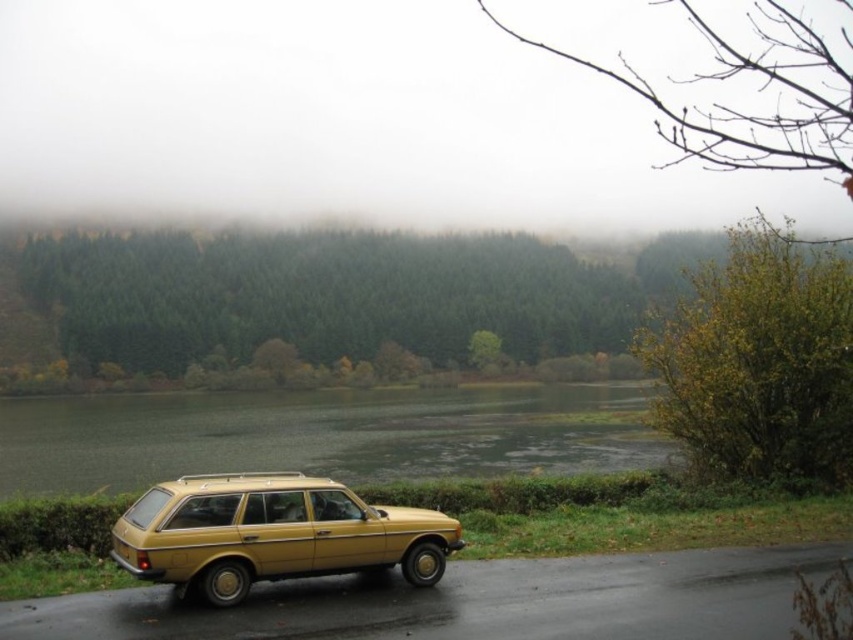
Is point (24, 476) positioned in front of point (184, 545)?

No, it is not.

Between point (331, 424) and point (361, 536), which one is positioned in front?

Point (361, 536)

This screenshot has width=853, height=640. What do you see at coordinates (322, 435) in the screenshot?
I see `green matte water at center` at bounding box center [322, 435].

You are a GUI agent. You are given a task and a screenshot of the screen. Output one action in this format:
    pyautogui.click(x=<x>, y=<y>)
    Task: Click on the green matte water at center
    This screenshot has height=640, width=853.
    Given the screenshot: What is the action you would take?
    pyautogui.click(x=322, y=435)